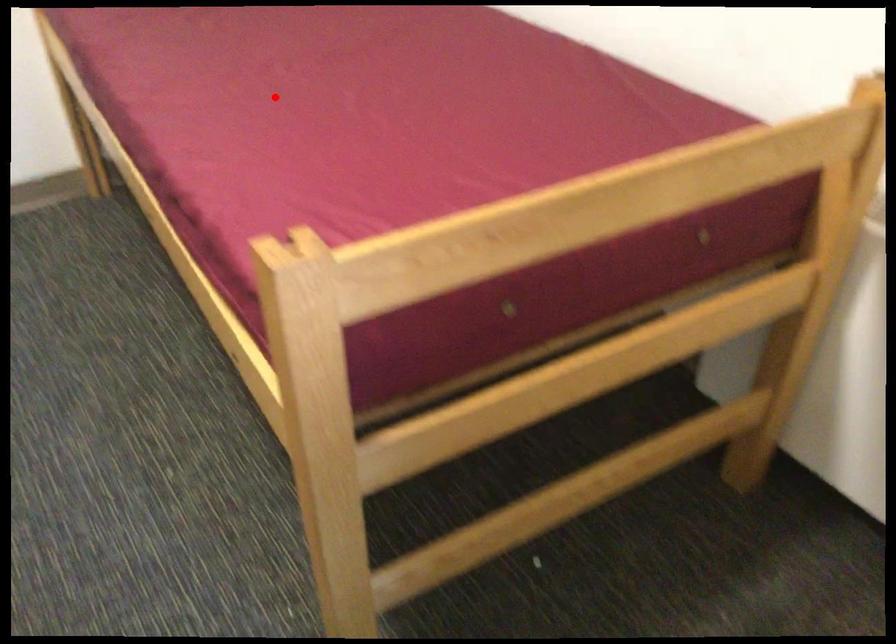
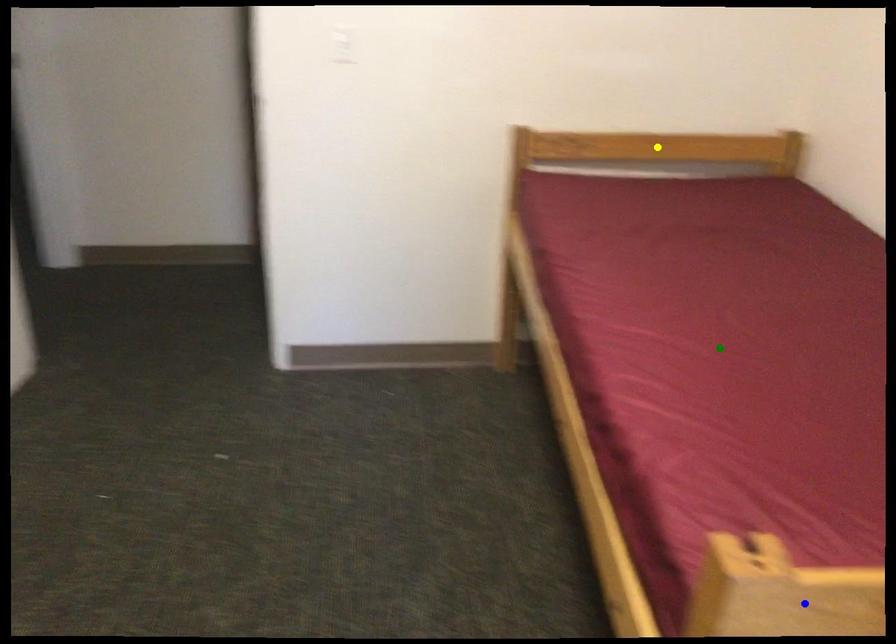
Question: I am providing you with two images of the same scene from different viewpoints. A red point is marked on the first image. You are given multiple points on the second image. In image 2, which mark is for the same physical point as the one in image 1?

Choices:
 (A) green point
 (B) blue point
 (C) yellow point

Answer: (A)